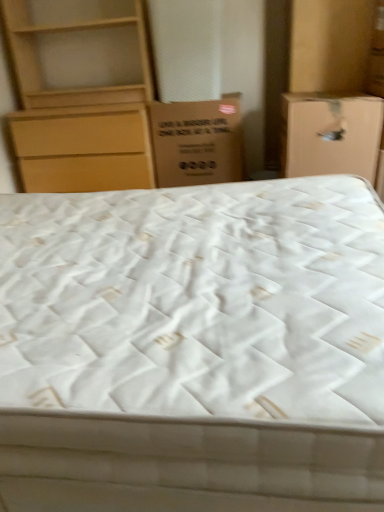
Question: Considering the relative positions of brown cardboard box at center, which is the second cardboard box from right to left, and matte wood chest of drawers at upper left in the image provided, is brown cardboard box at center, which is the second cardboard box from right to left, to the left of matte wood chest of drawers at upper left from the viewer's perspective?

Choices:
 (A) yes
 (B) no

Answer: (B)

Question: From a real-world perspective, is brown cardboard box at center, which is the second cardboard box from right to left, positioned under matte wood chest of drawers at upper left based on gravity?

Choices:
 (A) no
 (B) yes

Answer: (B)

Question: From the image's perspective, is brown cardboard box at center, which is the second cardboard box from right to left, on top of matte wood chest of drawers at upper left?

Choices:
 (A) yes
 (B) no

Answer: (B)

Question: Considering the relative sizes of brown cardboard box at center, which is the second cardboard box from right to left, and matte wood chest of drawers at upper left in the image provided, is brown cardboard box at center, which is the second cardboard box from right to left, bigger than matte wood chest of drawers at upper left?

Choices:
 (A) yes
 (B) no

Answer: (B)

Question: Could you tell me if brown cardboard box at center, which appears as the 1th cardboard box when viewed from the left, is turned towards matte wood chest of drawers at upper left?

Choices:
 (A) no
 (B) yes

Answer: (A)

Question: Can you confirm if brown cardboard box at center, which is the second cardboard box from right to left, is shorter than matte wood chest of drawers at upper left?

Choices:
 (A) yes
 (B) no

Answer: (A)

Question: From the image's perspective, does matte cardboard box at right, the 1th cardboard box viewed from the right, appear higher than white quilted mattress at center?

Choices:
 (A) yes
 (B) no

Answer: (A)

Question: Can we say matte cardboard box at right, which is the second cardboard box in left-to-right order, lies outside white quilted mattress at center?

Choices:
 (A) no
 (B) yes

Answer: (B)

Question: Does matte cardboard box at right, which is the second cardboard box in left-to-right order, appear on the right side of white quilted mattress at center?

Choices:
 (A) no
 (B) yes

Answer: (B)

Question: From the image's perspective, does matte cardboard box at right, which is the second cardboard box in left-to-right order, appear lower than white quilted mattress at center?

Choices:
 (A) yes
 (B) no

Answer: (B)

Question: Does matte cardboard box at right, which is the second cardboard box in left-to-right order, turn towards white quilted mattress at center?

Choices:
 (A) no
 (B) yes

Answer: (B)

Question: Considering the relative sizes of matte cardboard box at right, the 1th cardboard box viewed from the right, and white quilted mattress at center in the image provided, is matte cardboard box at right, the 1th cardboard box viewed from the right, thinner than white quilted mattress at center?

Choices:
 (A) yes
 (B) no

Answer: (A)

Question: Does matte cardboard box at right, which is the second cardboard box in left-to-right order, appear on the left side of matte wood chest of drawers at upper left?

Choices:
 (A) yes
 (B) no

Answer: (B)